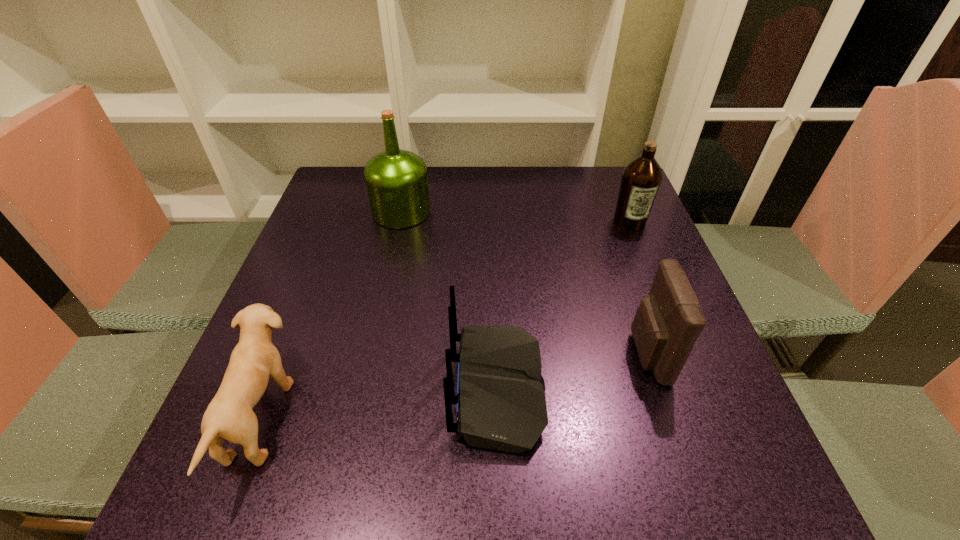
Find the location of a particular element. the left olive oil is located at coordinates (396, 180).

Locate an element on the screen. The width and height of the screenshot is (960, 540). the taller olive oil is located at coordinates (396, 180).

Locate an element on the screen. This screenshot has width=960, height=540. the second tallest object is located at coordinates (641, 178).

Find the location of a particular element. This screenshot has height=540, width=960. the shorter olive oil is located at coordinates (641, 178).

This screenshot has height=540, width=960. I want to click on pouch, so click(x=669, y=320).

Locate an element on the screen. The width and height of the screenshot is (960, 540). the third object from left to right is located at coordinates (501, 405).

You are a GUI agent. You are given a task and a screenshot of the screen. Output one action in this format:
    pyautogui.click(x=<x>, y=<y>)
    Task: Click on the leftmost object
    
    Given the screenshot: What is the action you would take?
    pyautogui.click(x=229, y=415)

I want to click on vacant space situated 0.120m on the left of the fourth object from right to left, so click(326, 212).

You are a GUI agent. You are given a task and a screenshot of the screen. Output one action in this format:
    pyautogui.click(x=<x>, y=<y>)
    Task: Click on the vacant space located 0.100m on the label of the fourth shortest object
    The image size is (960, 540).
    Given the screenshot: What is the action you would take?
    pyautogui.click(x=645, y=259)

Locate an element on the screen. blank area located 0.060m with an open flap on the pouch is located at coordinates (599, 354).